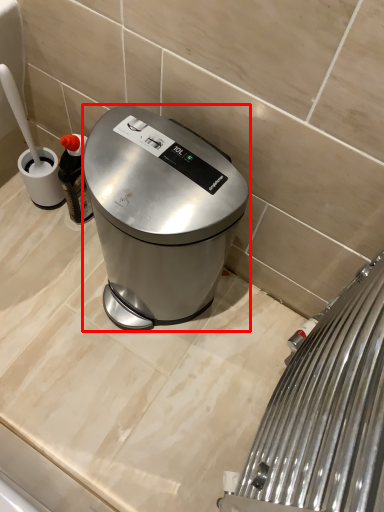
Question: From the image's perspective, where is kitchen appliance (annotated by the red box) located in relation to home appliance in the image?

Choices:
 (A) below
 (B) above

Answer: (B)